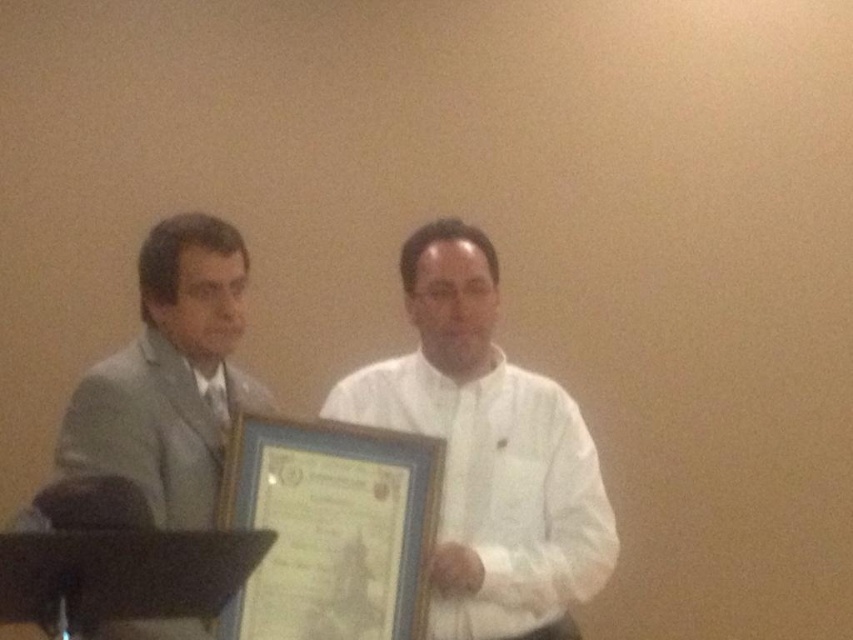
Question: Can you confirm if white matte shirt at center is smaller than light gray suit at left?

Choices:
 (A) yes
 (B) no

Answer: (B)

Question: Which object appears farthest from the camera in this image?

Choices:
 (A) light gray suit at left
 (B) white matte shirt at center

Answer: (B)

Question: Is white matte shirt at center thinner than light gray suit at left?

Choices:
 (A) yes
 (B) no

Answer: (B)

Question: Which of the following is the closest to the observer?

Choices:
 (A) white matte shirt at center
 (B) light gray suit at left

Answer: (B)

Question: Among these points, which one is nearest to the camera?

Choices:
 (A) (465, 369)
 (B) (123, 436)

Answer: (B)

Question: Is white matte shirt at center to the left of light gray suit at left from the viewer's perspective?

Choices:
 (A) yes
 (B) no

Answer: (B)